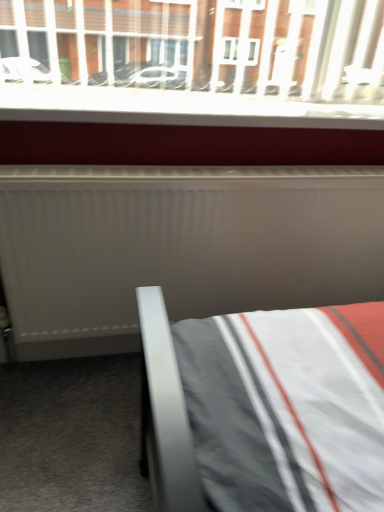
Image resolution: width=384 pixels, height=512 pixels. Describe the element at coordinates (178, 108) in the screenshot. I see `white plastic window sill at upper center` at that location.

This screenshot has width=384, height=512. What are the coordinates of `white plastic window sill at upper center` in the screenshot? It's located at (178, 108).

Measure the distance between white plastic window sill at upper center and camera.

white plastic window sill at upper center is 3.90 feet from camera.

Where is `white matte radiator at center`? white matte radiator at center is located at coordinates (183, 242).

What do you see at coordinates (183, 242) in the screenshot? The width and height of the screenshot is (384, 512). I see `white matte radiator at center` at bounding box center [183, 242].

What are the coordinates of `white plastic window sill at upper center` in the screenshot? It's located at (178, 108).

Considering the relative positions of white plastic window sill at upper center and white matte radiator at center in the image provided, is white plastic window sill at upper center to the left of white matte radiator at center from the viewer's perspective?

Indeed, white plastic window sill at upper center is positioned on the left side of white matte radiator at center.

Which is behind, white plastic window sill at upper center or white matte radiator at center?

white plastic window sill at upper center is further from the camera.

Considering the positions of points (107, 109) and (181, 234), is point (107, 109) farther from camera compared to point (181, 234)?

No, it is not.

From the image's perspective, is white plastic window sill at upper center above or below white matte radiator at center?

Based on their image positions, white plastic window sill at upper center is located above white matte radiator at center.

From a real-world perspective, relative to white matte radiator at center, is white plastic window sill at upper center vertically above or below?

white plastic window sill at upper center is above white matte radiator at center.

Considering the sizes of objects white plastic window sill at upper center and white matte radiator at center in the image provided, who is wider, white plastic window sill at upper center or white matte radiator at center?

white plastic window sill at upper center.

Between white plastic window sill at upper center and white matte radiator at center, which one has more height?

Standing taller between the two is white matte radiator at center.

Based on their sizes in the image, would you say white plastic window sill at upper center is bigger or smaller than white matte radiator at center?

Clearly, white plastic window sill at upper center is smaller in size than white matte radiator at center.

Is white plastic window sill at upper center inside the boundaries of white matte radiator at center, or outside?

white plastic window sill at upper center exists outside the volume of white matte radiator at center.

Are white plastic window sill at upper center and white matte radiator at center beside each other?

No, white plastic window sill at upper center is not with white matte radiator at center.

Is white plastic window sill at upper center facing away from white matte radiator at center?

No, white plastic window sill at upper center is not facing the opposite direction of white matte radiator at center.

The image size is (384, 512). I want to click on radiator below the white plastic window sill at upper center (from a real-world perspective), so click(x=183, y=242).

From the picture: Is white matte radiator at center to the left or to the right of white plastic window sill at upper center in the image?

In the image, white matte radiator at center appears on the right side of white plastic window sill at upper center.

Considering their positions, is white matte radiator at center located in front of or behind white plastic window sill at upper center?

white matte radiator at center is positioned closer to the viewer than white plastic window sill at upper center.

Which is closer, (x=276, y=221) or (x=239, y=99)?

Point (x=276, y=221) is farther from the camera than point (x=239, y=99).

From the image's perspective, between white matte radiator at center and white plastic window sill at upper center, who is located below?

From the image's view, white matte radiator at center is below.

Consider the image. From a real-world perspective, is white matte radiator at center located beneath white plastic window sill at upper center?

Indeed, from a real-world perspective, white matte radiator at center is positioned beneath white plastic window sill at upper center.

From the picture: Considering the sizes of objects white matte radiator at center and white plastic window sill at upper center in the image provided, who is thinner, white matte radiator at center or white plastic window sill at upper center?

With smaller width is white matte radiator at center.

Can you confirm if white matte radiator at center is shorter than white plastic window sill at upper center?

Incorrect, the height of white matte radiator at center does not fall short of that of white plastic window sill at upper center.

Is white matte radiator at center bigger or smaller than white plastic window sill at upper center?

In the image, white matte radiator at center appears to be larger than white plastic window sill at upper center.

Is white plastic window sill at upper center surrounded by white matte radiator at center?

Definitely not — white plastic window sill at upper center is not inside white matte radiator at center.

Is white matte radiator at center in contact with white plastic window sill at upper center?

No, white matte radiator at center is not next to white plastic window sill at upper center.

Could you tell me if white matte radiator at center is facing white plastic window sill at upper center?

No, white matte radiator at center is not turned towards white plastic window sill at upper center.

Identify the location of radiator in front of the white plastic window sill at upper center. The width and height of the screenshot is (384, 512). (183, 242).

You are a GUI agent. You are given a task and a screenshot of the screen. Output one action in this format:
    pyautogui.click(x=<x>, y=<y>)
    Task: Click on the radiator in front of the white plastic window sill at upper center
    
    Given the screenshot: What is the action you would take?
    pyautogui.click(x=183, y=242)

Locate an element on the screen. Image resolution: width=384 pixels, height=512 pixels. window sill that appears on the left of white matte radiator at center is located at coordinates (178, 108).